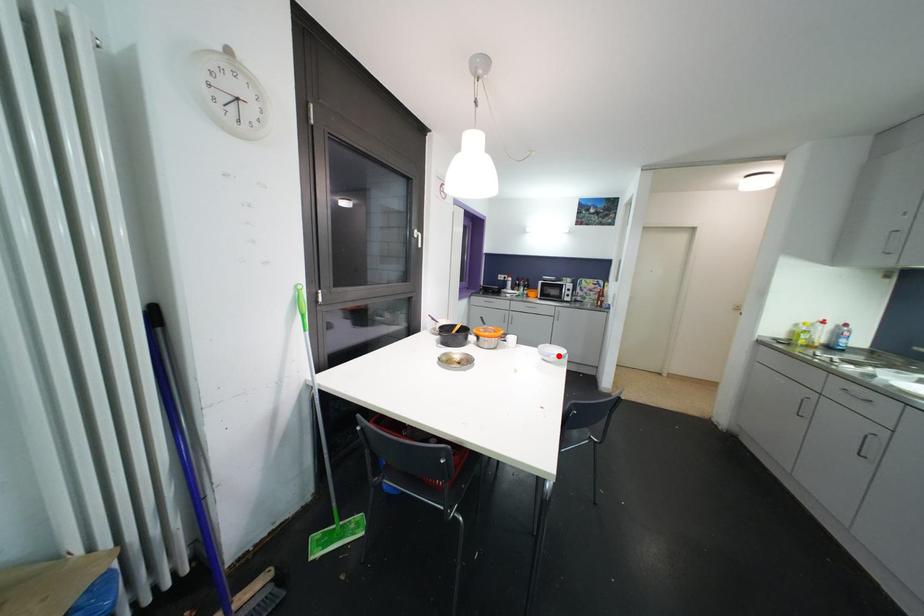
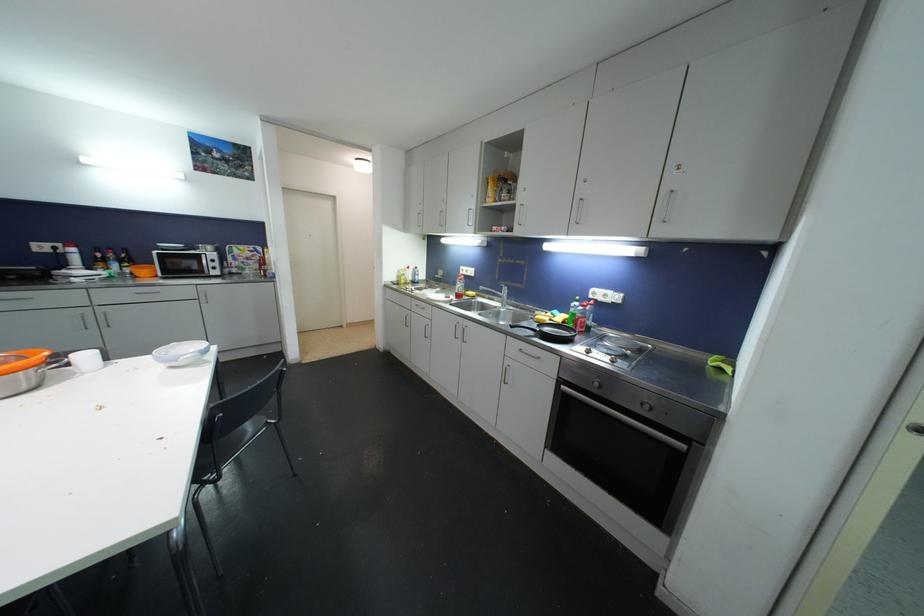
In the second image, find the point that corresponds to the highlighted location in the first image.

(195, 354)